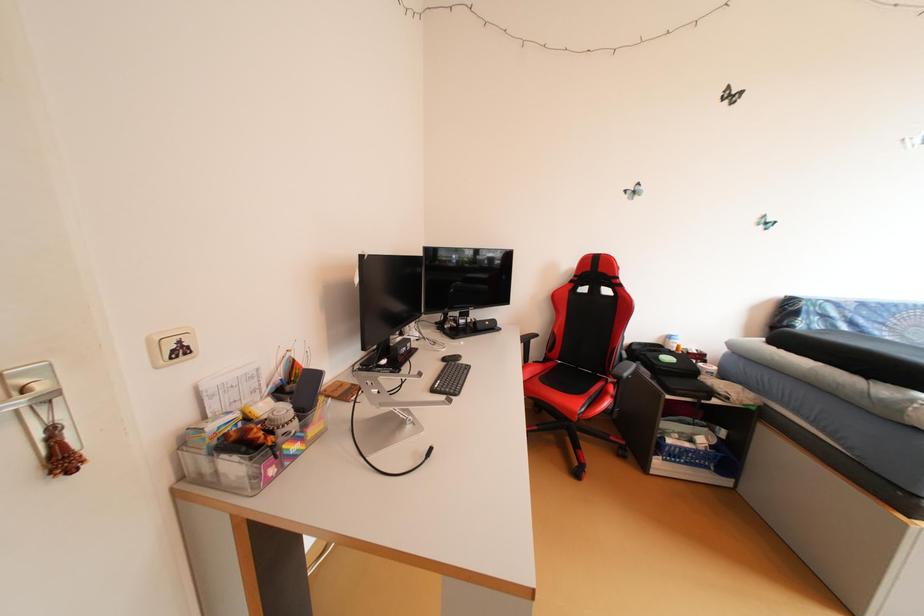
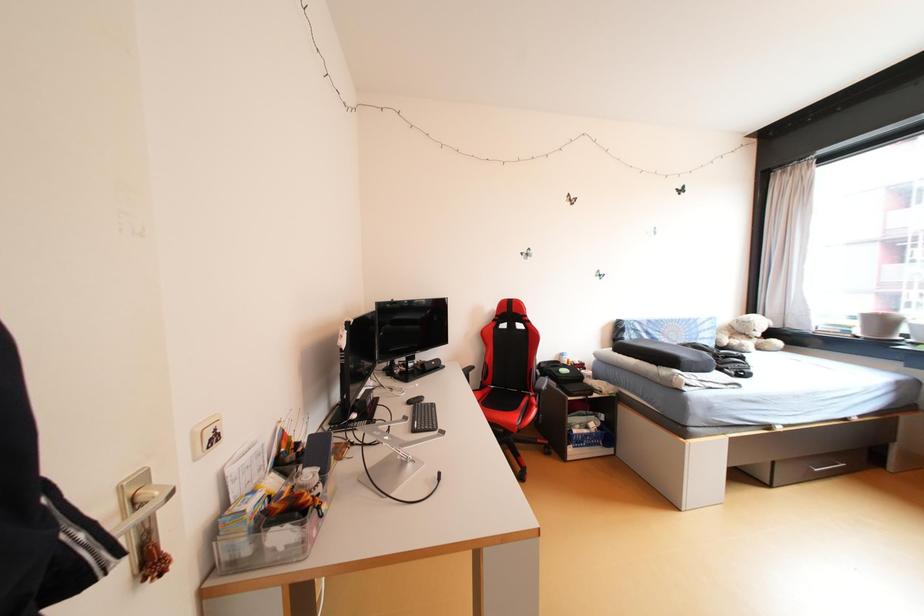
Question: The camera is either moving clockwise (left) or counter-clockwise (right) around the object. The first image is from the beginning of the video and the second image is from the end. Is the camera moving left or right when shooting the video?

Choices:
 (A) Left
 (B) Right

Answer: (A)